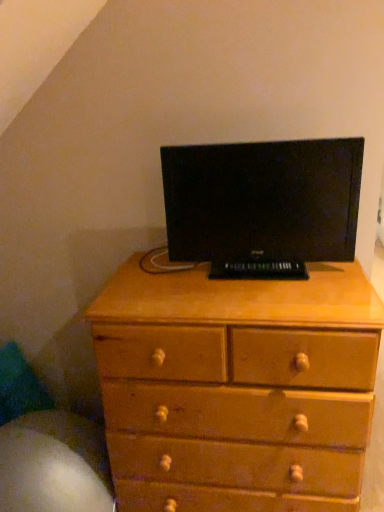
Question: Should I look upward or downward to see black matte computer monitor at center?

Choices:
 (A) down
 (B) up

Answer: (B)

Question: Considering the relative sizes of light brown wood chest of drawers at center and black matte computer monitor at center in the image provided, is light brown wood chest of drawers at center bigger than black matte computer monitor at center?

Choices:
 (A) yes
 (B) no

Answer: (A)

Question: Would you say light brown wood chest of drawers at center is outside black matte computer monitor at center?

Choices:
 (A) no
 (B) yes

Answer: (B)

Question: From the image's perspective, would you say light brown wood chest of drawers at center is shown under black matte computer monitor at center?

Choices:
 (A) yes
 (B) no

Answer: (A)

Question: Does light brown wood chest of drawers at center turn towards black matte computer monitor at center?

Choices:
 (A) yes
 (B) no

Answer: (B)

Question: From a real-world perspective, is light brown wood chest of drawers at center located beneath black matte computer monitor at center?

Choices:
 (A) yes
 (B) no

Answer: (A)

Question: Can you confirm if light brown wood chest of drawers at center is wider than black matte computer monitor at center?

Choices:
 (A) no
 (B) yes

Answer: (B)

Question: From a real-world perspective, does black matte computer monitor at center sit lower than light brown wood chest of drawers at center?

Choices:
 (A) yes
 (B) no

Answer: (B)

Question: Does black matte computer monitor at center lie in front of light brown wood chest of drawers at center?

Choices:
 (A) yes
 (B) no

Answer: (B)

Question: Is black matte computer monitor at center oriented away from light brown wood chest of drawers at center?

Choices:
 (A) yes
 (B) no

Answer: (B)

Question: Does black matte computer monitor at center have a lesser height compared to light brown wood chest of drawers at center?

Choices:
 (A) yes
 (B) no

Answer: (A)

Question: Are black matte computer monitor at center and light brown wood chest of drawers at center making contact?

Choices:
 (A) no
 (B) yes

Answer: (A)

Question: Can you confirm if black matte computer monitor at center is taller than light brown wood chest of drawers at center?

Choices:
 (A) yes
 (B) no

Answer: (B)

Question: Does point (314, 406) appear closer or farther from the camera than point (329, 189)?

Choices:
 (A) closer
 (B) farther

Answer: (A)